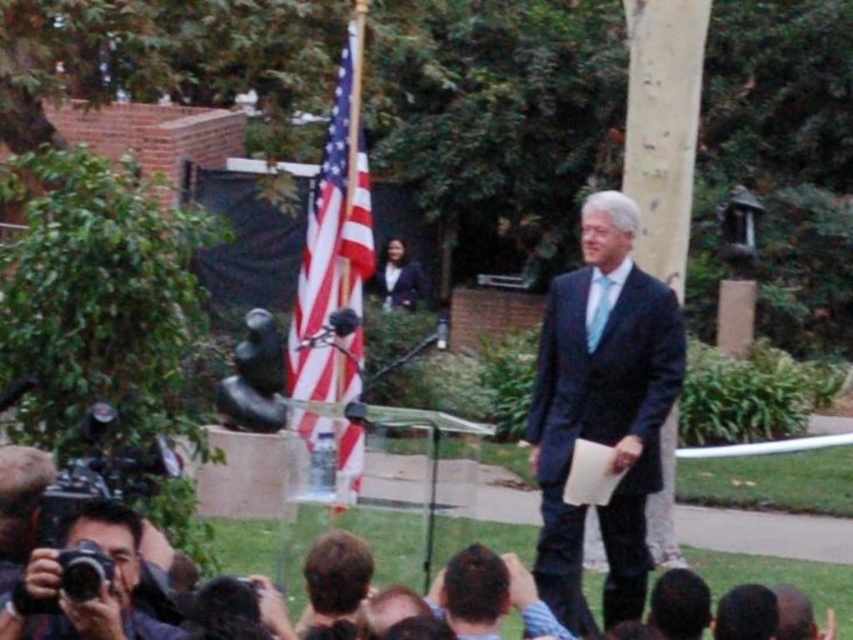
Question: Which of the following is the closest to the observer?

Choices:
 (A) matte black camera at lower left
 (B) matte black suit at center
 (C) american flag at center

Answer: (A)

Question: Is american flag at center further to the viewer compared to dark hair human heads at lower center?

Choices:
 (A) no
 (B) yes

Answer: (B)

Question: Which of the following is the closest to the observer?

Choices:
 (A) american flag at center
 (B) dark blue suit at center

Answer: (B)

Question: Observing the image, what is the correct spatial positioning of dark blue suit at center in reference to american flag at center?

Choices:
 (A) above
 (B) below

Answer: (B)

Question: Which object appears closest to the camera in this image?

Choices:
 (A) matte black camera at lower left
 (B) light blue silk tie at center
 (C) american flag at center

Answer: (A)

Question: Does dark blue suit at center lie in front of dark hair human heads at lower center?

Choices:
 (A) no
 (B) yes

Answer: (B)